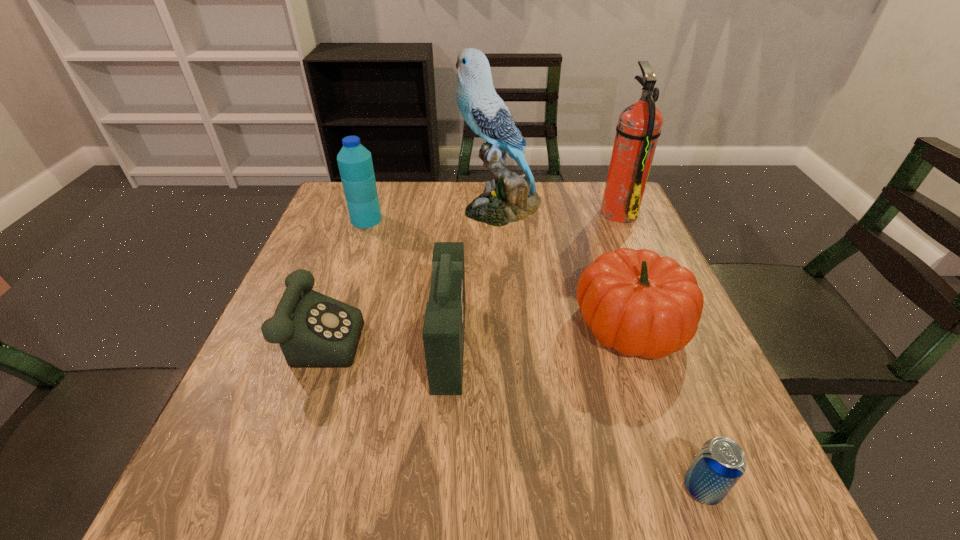
At what (x,y) coordinates should I click in order to perform the action: click on object present at the near right corner. Please return your answer as a coordinate pair (x, y). Looking at the image, I should click on (720, 463).

Locate an element on the screen. This screenshot has height=540, width=960. vacant space at the far edge of the desktop is located at coordinates (426, 226).

This screenshot has width=960, height=540. Identify the location of vacant space at the near edge. (561, 464).

The height and width of the screenshot is (540, 960). In the image, there is a desktop. Identify the location of blank space at the left edge. (273, 447).

You are a GUI agent. You are given a task and a screenshot of the screen. Output one action in this format:
    pyautogui.click(x=<x>, y=<y>)
    Task: Click on the blank area at the right edge
    The image size is (960, 540).
    Given the screenshot: What is the action you would take?
    pyautogui.click(x=679, y=356)

The image size is (960, 540). Find the location of `free space between the fire extinguisher and the first-aid kit`. free space between the fire extinguisher and the first-aid kit is located at coordinates [x=534, y=278].

Identify the location of vacant area between the fire extinguisher and the first-aid kit. [534, 278].

The image size is (960, 540). I want to click on free space between the fire extinguisher and the parakeet, so click(560, 210).

Where is `vacant space that's between the water bottle and the first-aid kit`? vacant space that's between the water bottle and the first-aid kit is located at coordinates (408, 282).

The image size is (960, 540). I want to click on free space between the beer can and the first-aid kit, so click(576, 416).